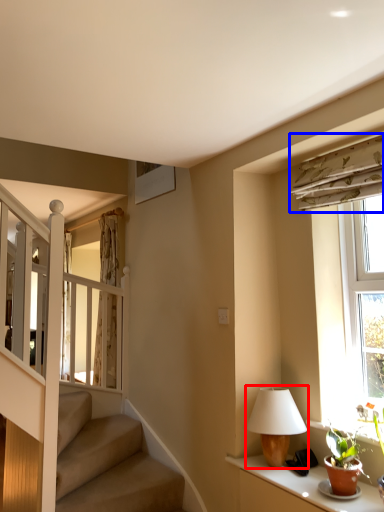
Question: Which of the following is the closest to the observer, table lamp (highlighted by a red box) or curtain (highlighted by a blue box)?

Choices:
 (A) table lamp
 (B) curtain

Answer: (B)